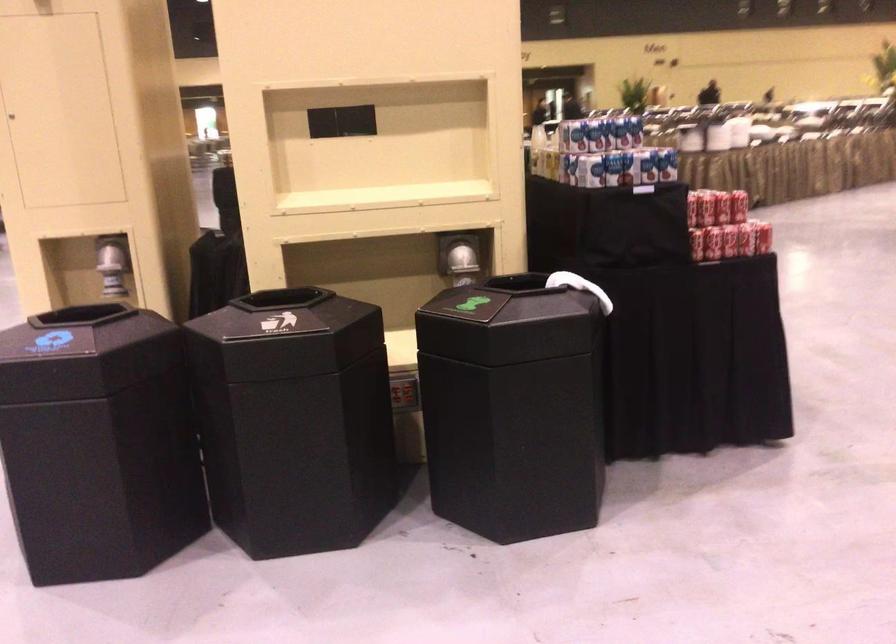
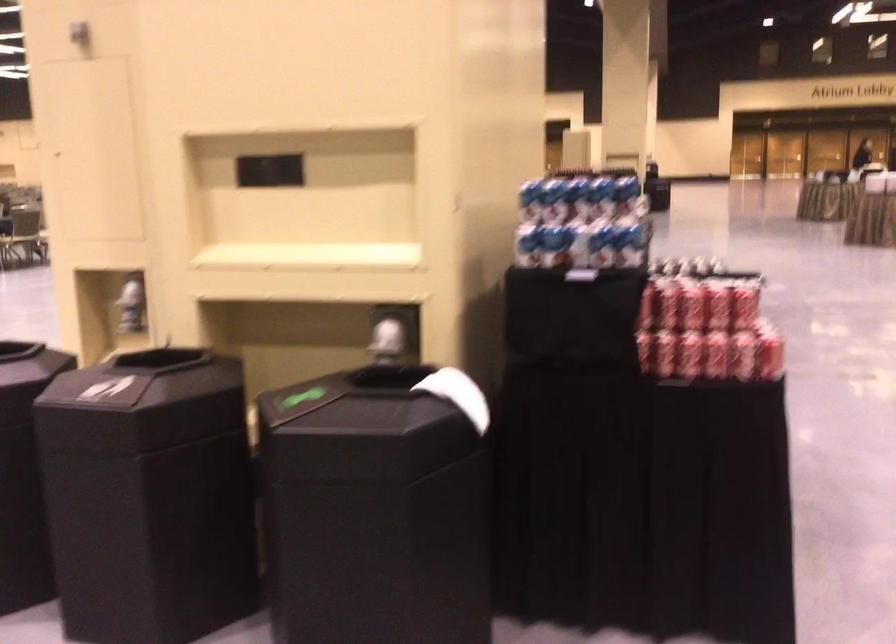
Where in the second image is the point corresponding to pixel 616 169 from the first image?

(553, 245)